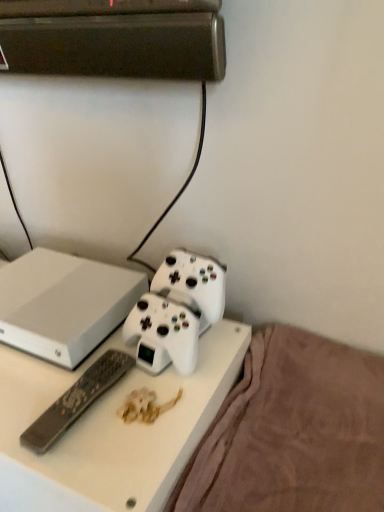
Question: Is black plastic remote at lower left to the left or to the right of white plastic desk at center in the image?

Choices:
 (A) right
 (B) left

Answer: (A)

Question: In terms of size, does black plastic remote at lower left appear bigger or smaller than white plastic desk at center?

Choices:
 (A) small
 (B) big

Answer: (A)

Question: Which of these objects is positioned closest to the black plastic remote at lower left?

Choices:
 (A) brown plush blanket at lower right
 (B) white matte gaming console at center
 (C) white plastic desk at center
 (D) white matte game controller at center

Answer: (C)

Question: Estimate the real-world distances between objects in this image. Which object is closer to the white matte game controller at center?

Choices:
 (A) brown plush blanket at lower right
 (B) black plastic remote at lower left
 (C) white matte gaming console at center
 (D) white plastic desk at center

Answer: (B)